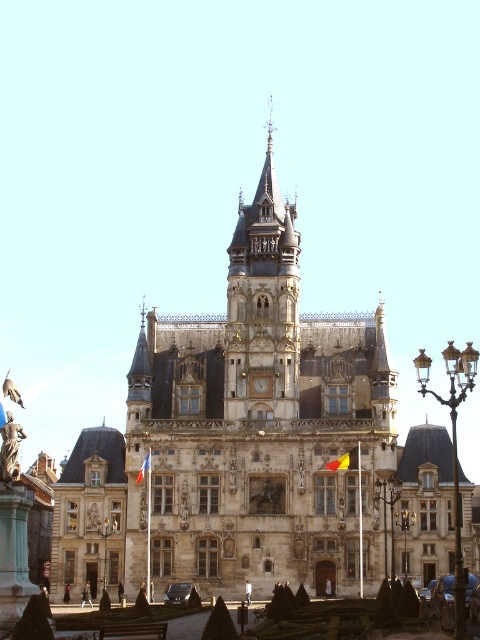
In the scene shown: Between stone clock tower at center and red fabric flag at center, which one appears on the left side from the viewer's perspective?

red fabric flag at center is more to the left.

Which is in front, point (259, 387) or point (143, 474)?

Positioned in front is point (143, 474).

Does point (266, 141) come farther from viewer compared to point (136, 476)?

That is True.

You are a GUI agent. You are given a task and a screenshot of the screen. Output one action in this format:
    pyautogui.click(x=<x>, y=<y>)
    Task: Click on the stone clock tower at center
    
    Given the screenshot: What is the action you would take?
    pyautogui.click(x=263, y=305)

Does stone castle at center appear over stone clock tower at center?

No.

Can you confirm if stone castle at center is positioned to the right of stone clock tower at center?

No, stone castle at center is not to the right of stone clock tower at center.

Which is in front, point (220, 426) or point (264, 371)?

Point (220, 426)

Image resolution: width=480 pixels, height=640 pixels. I want to click on stone castle at center, so click(x=254, y=442).

Which is more to the left, stone castle at center or yellow fabric flag at center?

Positioned to the left is stone castle at center.

Is point (343, 419) positioned in front of point (339, 460)?

No, it is behind (339, 460).

Find the location of a particular element. The height and width of the screenshot is (640, 480). stone castle at center is located at coordinates (254, 442).

At what (x,y) coordinates should I click in order to perform the action: click on stone castle at center. Please return your answer as a coordinate pair (x, y). Looking at the image, I should click on (254, 442).